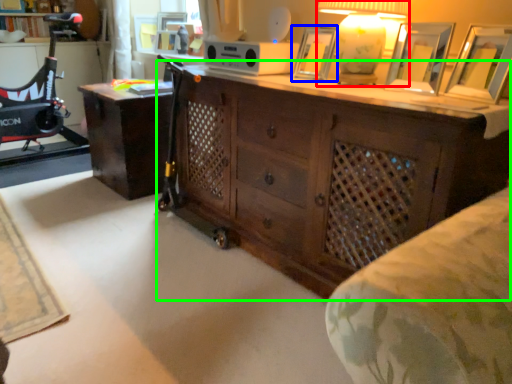
Question: Considering the real-world distances, which object is closest to table lamp (highlighted by a red box)? picture frame (highlighted by a blue box) or chest of drawers (highlighted by a green box).

Choices:
 (A) picture frame
 (B) chest of drawers

Answer: (A)